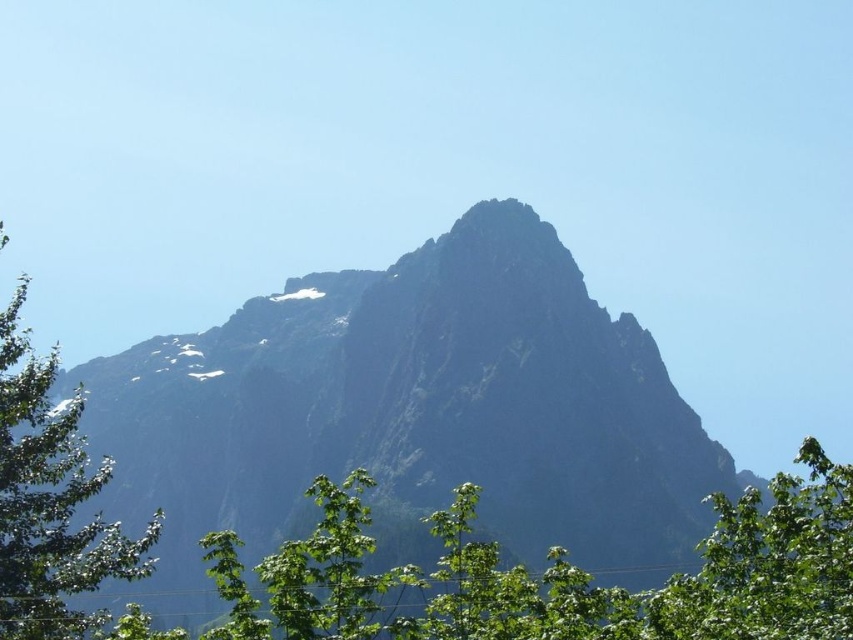
Question: Which point is closer to the camera taking this photo?

Choices:
 (A) (238, 456)
 (B) (650, 611)

Answer: (B)

Question: Is green leafy tree at left positioned before green leafy tree at lower right?

Choices:
 (A) no
 (B) yes

Answer: (A)

Question: Which point is farther to the camera?

Choices:
 (A) rugged stone mountain at center
 (B) green leafy tree at left
 (C) green leafy tree at lower right

Answer: (A)

Question: Which point is closer to the camera taking this photo?

Choices:
 (A) (805, 577)
 (B) (549, 387)
 (C) (19, 509)

Answer: (C)

Question: Is green leafy tree at left further to the viewer compared to green leafy tree at lower right?

Choices:
 (A) yes
 (B) no

Answer: (A)

Question: Considering the relative positions of rugged stone mountain at center and green leafy tree at left in the image provided, where is rugged stone mountain at center located with respect to green leafy tree at left?

Choices:
 (A) below
 (B) above

Answer: (A)